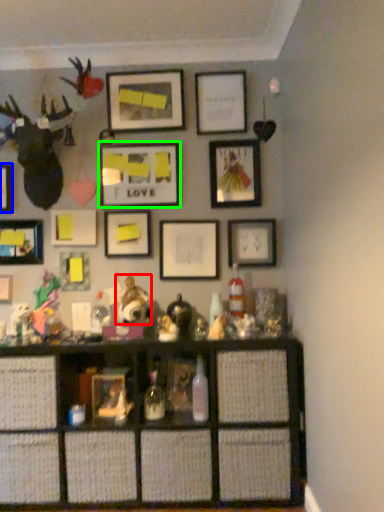
Question: Estimate the real-world distances between objects in this image. Which object is closer to toy (highlighted by a red box), picture frame (highlighted by a blue box) or picture frame (highlighted by a green box)?

Choices:
 (A) picture frame
 (B) picture frame

Answer: (B)